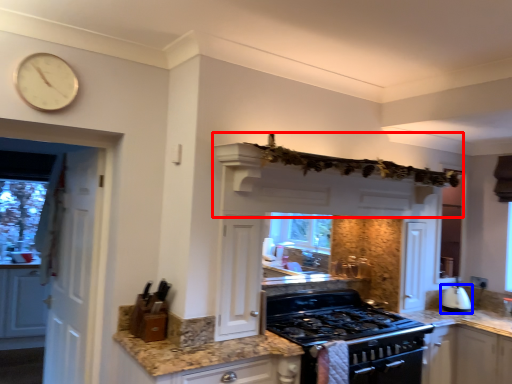
Question: Which object is closer to the camera taking this photo, exhaust hood (highlighted by a red box) or kitchen appliance (highlighted by a blue box)?

Choices:
 (A) exhaust hood
 (B) kitchen appliance

Answer: (A)